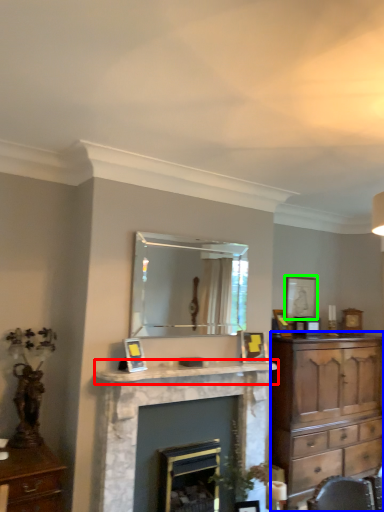
Question: Based on their relative distances, which object is nearer to mantle (highlighted by a red box)? Choose from chest of drawers (highlighted by a blue box) and picture frame (highlighted by a green box).

Choices:
 (A) chest of drawers
 (B) picture frame

Answer: (A)